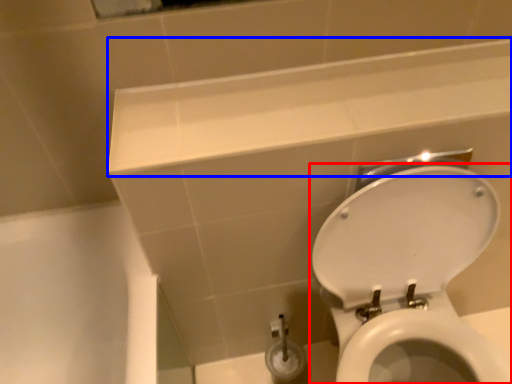
Question: Which object is closer to the camera taking this photo, toilet (highlighted by a red box) or ledge (highlighted by a blue box)?

Choices:
 (A) toilet
 (B) ledge

Answer: (A)